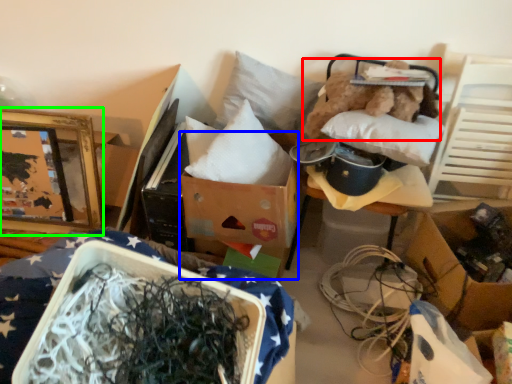
Question: Based on their relative distances, which object is nearer to teddy (highlighted by a red box)? Choose from cardboard box (highlighted by a blue box) and picture frame (highlighted by a green box).

Choices:
 (A) cardboard box
 (B) picture frame

Answer: (A)